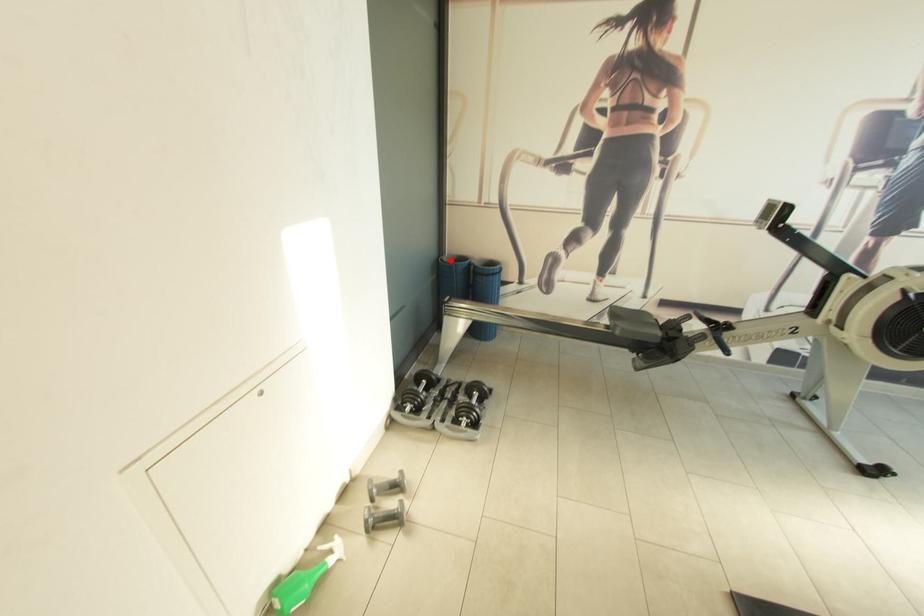
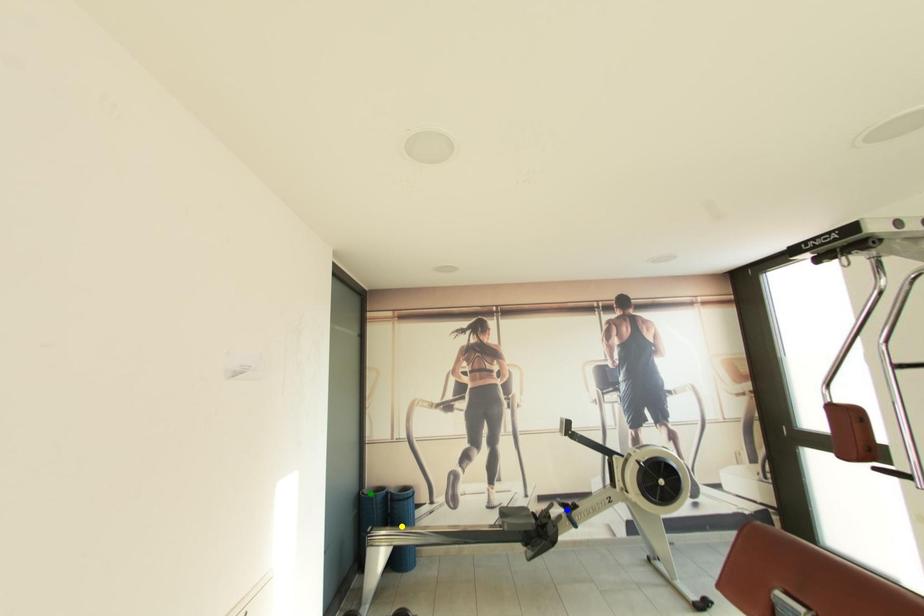
Question: I am providing you with two images of the same scene from different viewpoints. A red point is marked on the first image. You are given multiple points on the second image. Which point in image 2 represents the same 3d spot as the red point in image 1?

Choices:
 (A) yellow point
 (B) green point
 (C) blue point

Answer: (B)